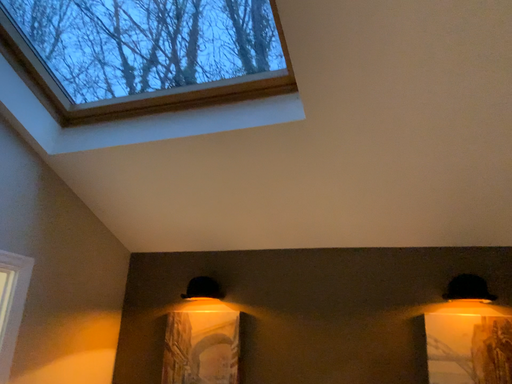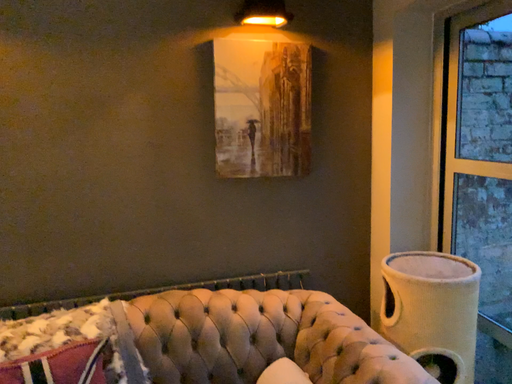
Question: Which way did the camera rotate in the video?

Choices:
 (A) rotated right
 (B) rotated left

Answer: (A)